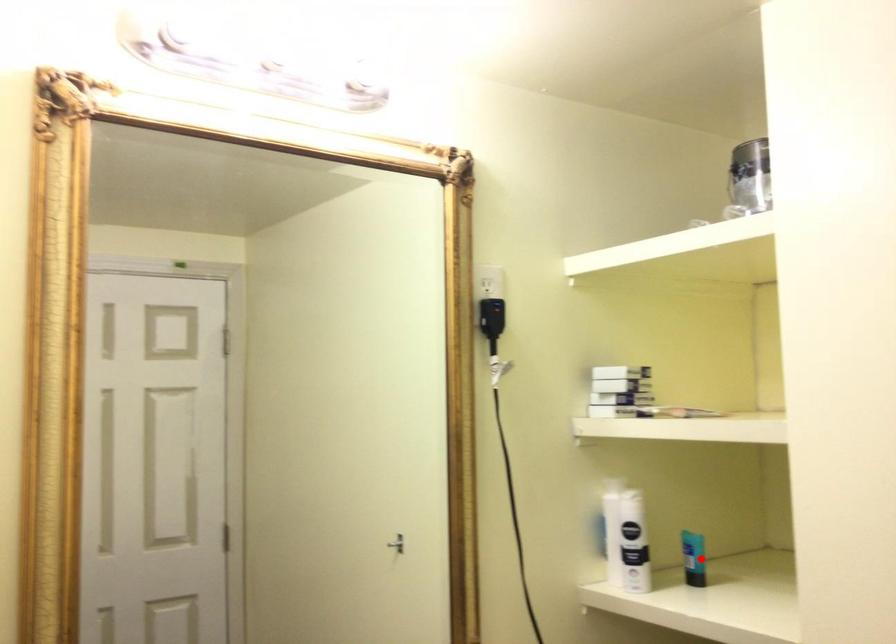
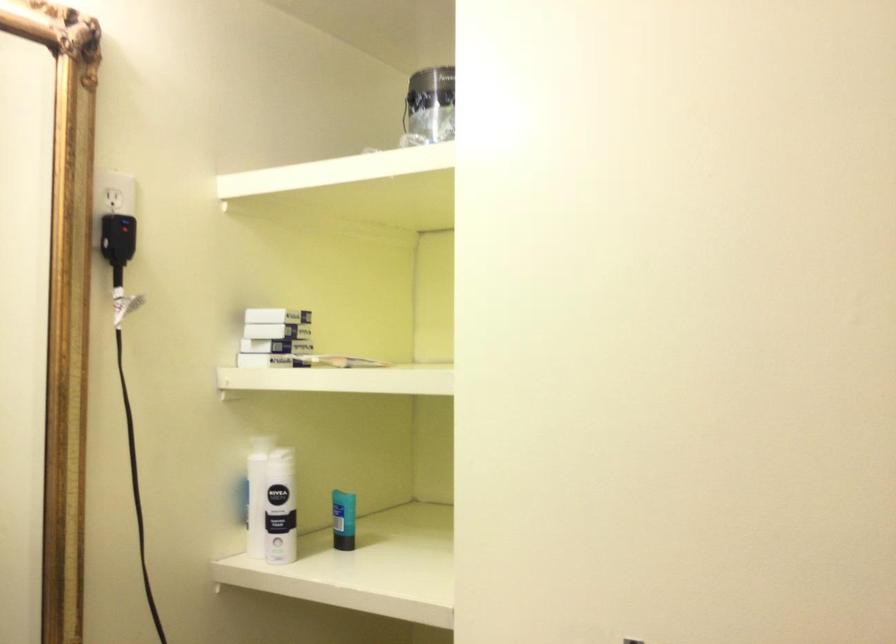
Where in the second image is the point corresponding to the highlighted location from the first image?

(343, 520)